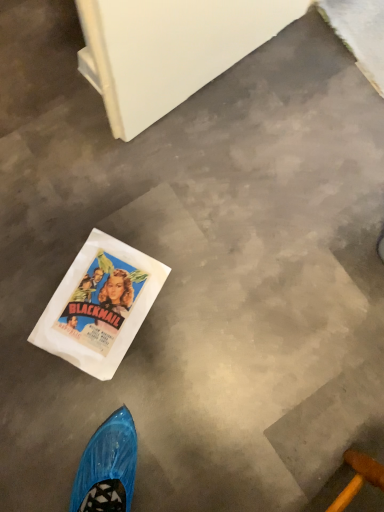
The image size is (384, 512). In order to click on vacant space to the right of white paper comic book at lower left in this screenshot , I will do `click(172, 346)`.